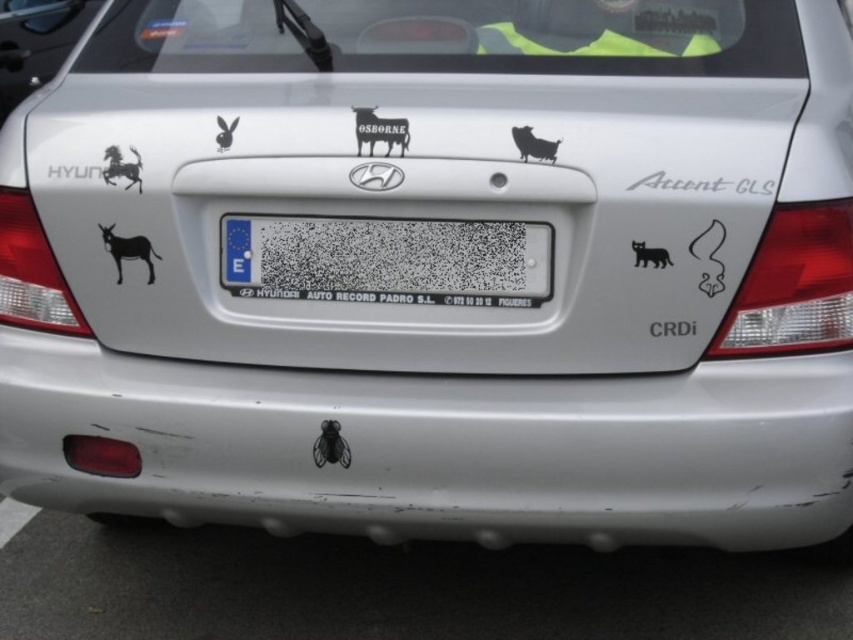
Question: Among these objects, which one is nearest to the camera?

Choices:
 (A) black matte cow at center
 (B) black glossy horse at upper left
 (C) black matte cat at right
 (D) white plastic license plate at center

Answer: (C)

Question: Which object is the closest to the white plastic license plate at center?

Choices:
 (A) black glossy horse at upper left
 (B) black glossy fly at lower center
 (C) black matte cat at right
 (D) black matte cow at center

Answer: (D)

Question: Which object is positioned farthest from the white matte bumper at lower center?

Choices:
 (A) black matte donkey at left
 (B) black matte cat at right
 (C) black matte cow at center
 (D) white plastic license plate at center

Answer: (C)

Question: Does black matte donkey at left appear under black glossy horse at upper left?

Choices:
 (A) no
 (B) yes

Answer: (B)

Question: Does black matte cow at center appear on the left side of black glossy horse at upper left?

Choices:
 (A) no
 (B) yes

Answer: (A)

Question: Is black matte cow at center to the left of black matte cat at right from the viewer's perspective?

Choices:
 (A) no
 (B) yes

Answer: (B)